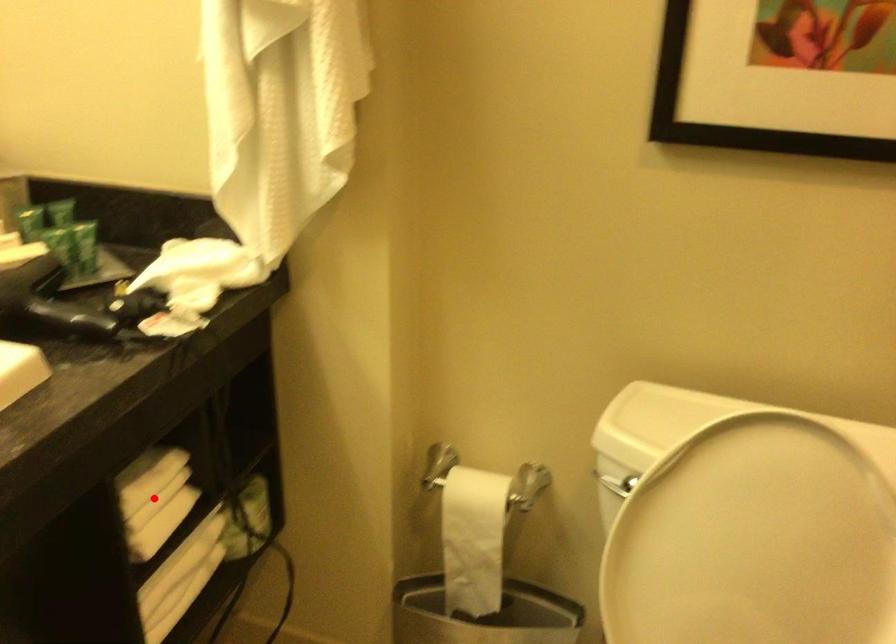
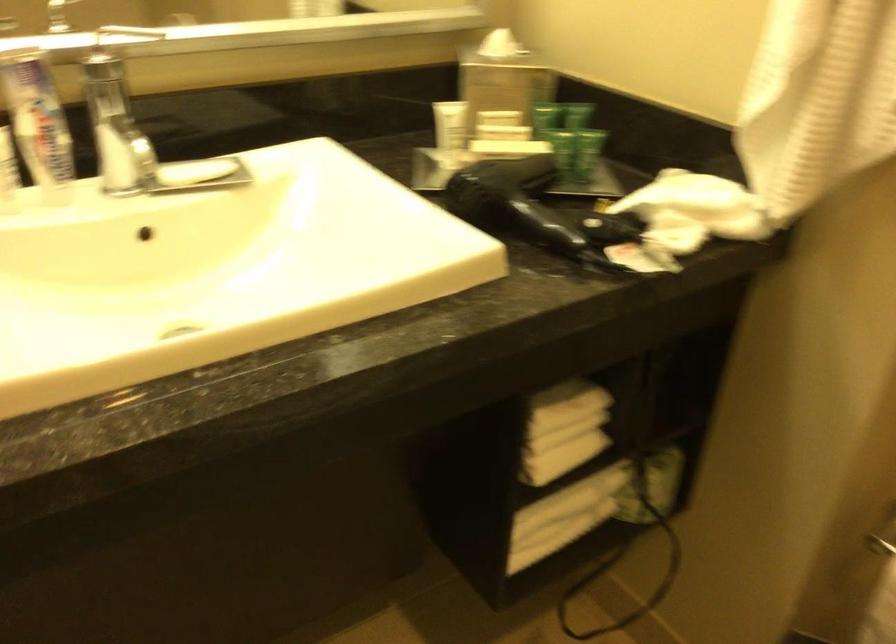
Where in the second image is the point corresponding to the highlighted location from the first image?

(563, 430)